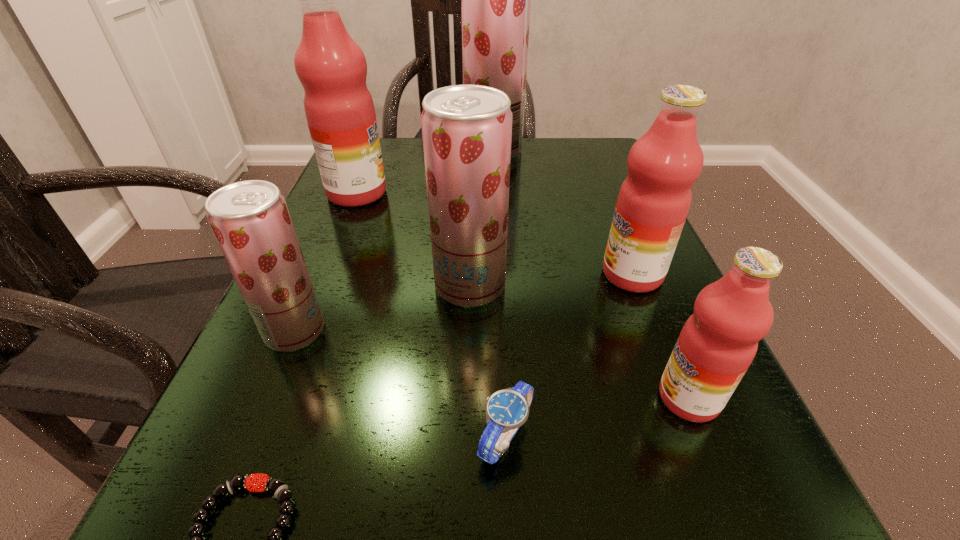
What are the coordinates of `blue watch` in the screenshot? It's located at (506, 410).

Find the location of a particular element. The width and height of the screenshot is (960, 540). watch is located at coordinates (506, 410).

Identify the location of vacant space situated on the left of the farthest object. (384, 150).

This screenshot has height=540, width=960. I want to click on free region located on the label of the leftmost pink fruit juice, so pyautogui.click(x=462, y=193).

At what (x,y) coordinates should I click in order to perform the action: click on free space located on the right of the second smallest strawberry fruit juice. Please return your answer as a coordinate pair (x, y). This screenshot has height=540, width=960. Looking at the image, I should click on (635, 285).

Identify the location of free location located 0.330m on the label of the second farthest pink fruit juice. The width and height of the screenshot is (960, 540). (404, 274).

I want to click on vacant space situated on the label of the second farthest pink fruit juice, so [x=548, y=274].

This screenshot has height=540, width=960. What are the coordinates of `vacant space located 0.230m on the label of the second farthest pink fruit juice` in the screenshot? It's located at (465, 274).

You are a GUI agent. You are given a task and a screenshot of the screen. Output one action in this format:
    pyautogui.click(x=<x>, y=<y>)
    Task: Click on the blank area located on the label of the nearest pink fruit juice
    The image size is (960, 540).
    Given the screenshot: What is the action you would take?
    pyautogui.click(x=381, y=398)

The height and width of the screenshot is (540, 960). Find the location of `vacant space located on the label of the nearest pink fruit juice`. vacant space located on the label of the nearest pink fruit juice is located at coordinates (492, 398).